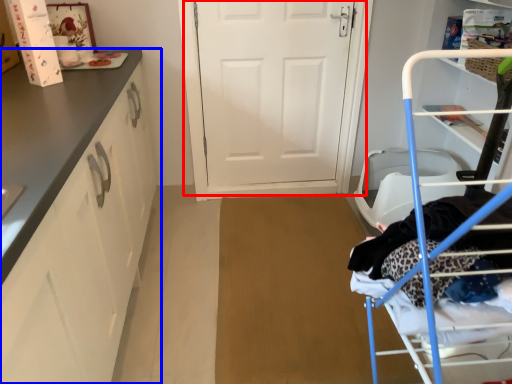
Question: Which object is further to the camera taking this photo, door (highlighted by a red box) or cabinetry (highlighted by a blue box)?

Choices:
 (A) door
 (B) cabinetry

Answer: (A)